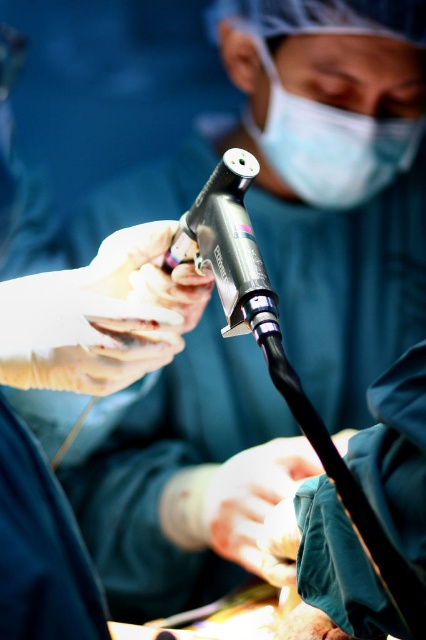
I want to click on metallic/smooth surgical instrument at center, so click(x=279, y=353).

This screenshot has width=426, height=640. What are the coordinates of `metallic/smooth surgical instrument at center` in the screenshot? It's located at (279, 353).

Locate an element on the screen. The image size is (426, 640). metallic/smooth surgical instrument at center is located at coordinates (279, 353).